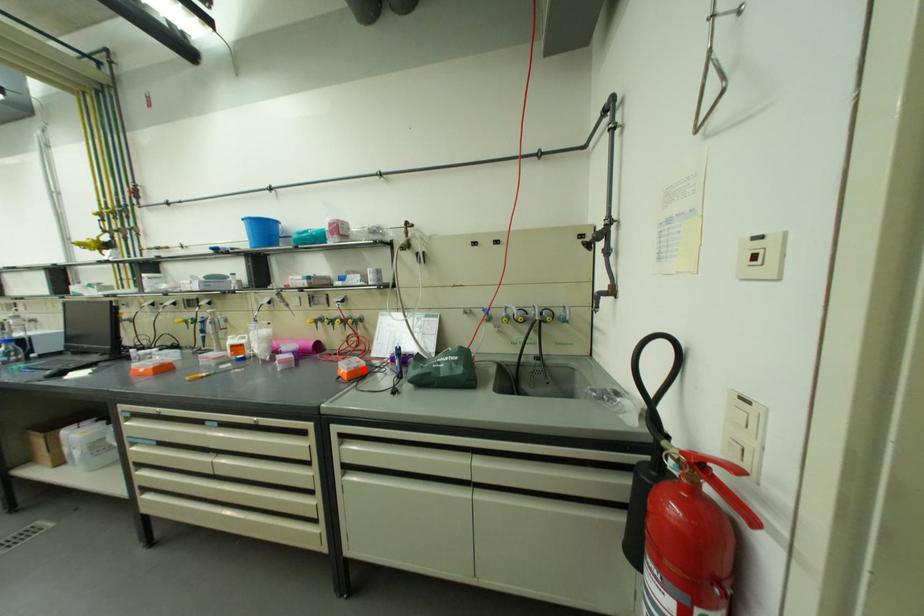
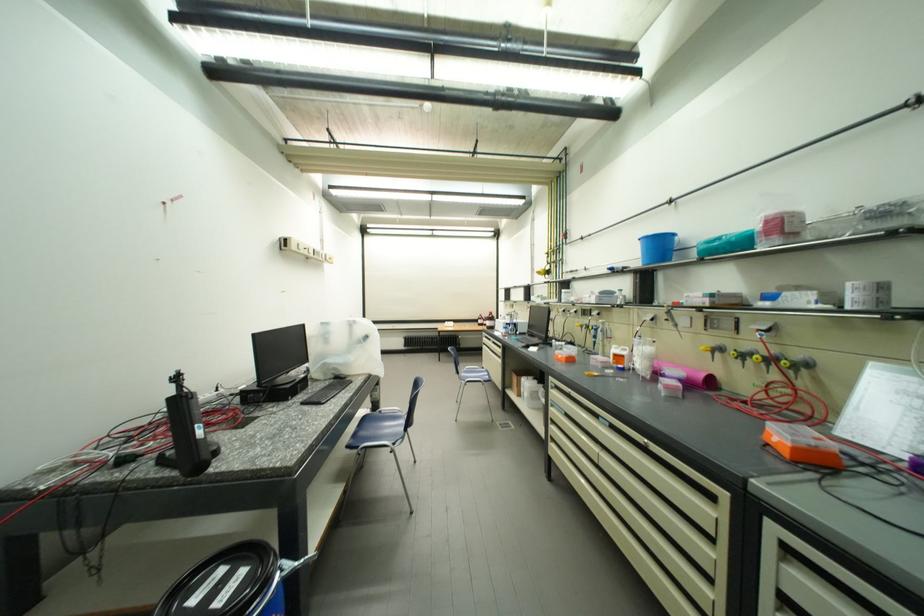
Locate, in the second image, the point that corresponds to the highlighted location in the first image.

(820, 447)